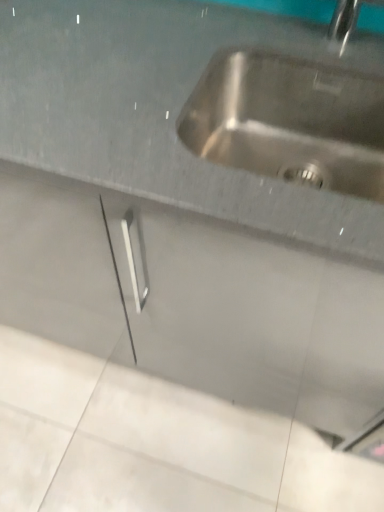
Measure the distance between stainless steel sink at upper right and camera.

stainless steel sink at upper right and camera are 28.58 inches apart.

This screenshot has width=384, height=512. What do you see at coordinates (289, 121) in the screenshot? I see `stainless steel sink at upper right` at bounding box center [289, 121].

Identify the location of stainless steel sink at upper right. This screenshot has width=384, height=512. (289, 121).

Identify the location of stainless steel sink at upper right. (289, 121).